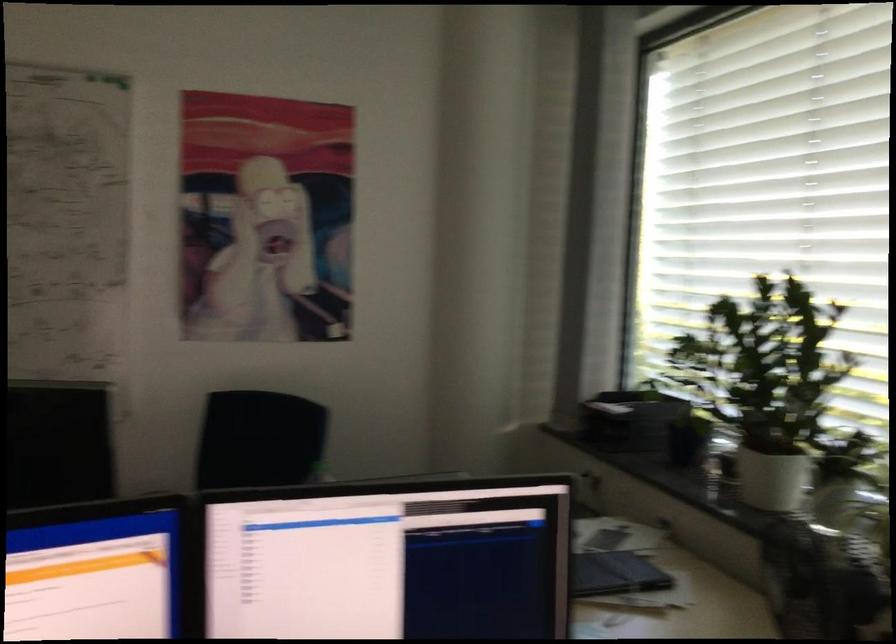
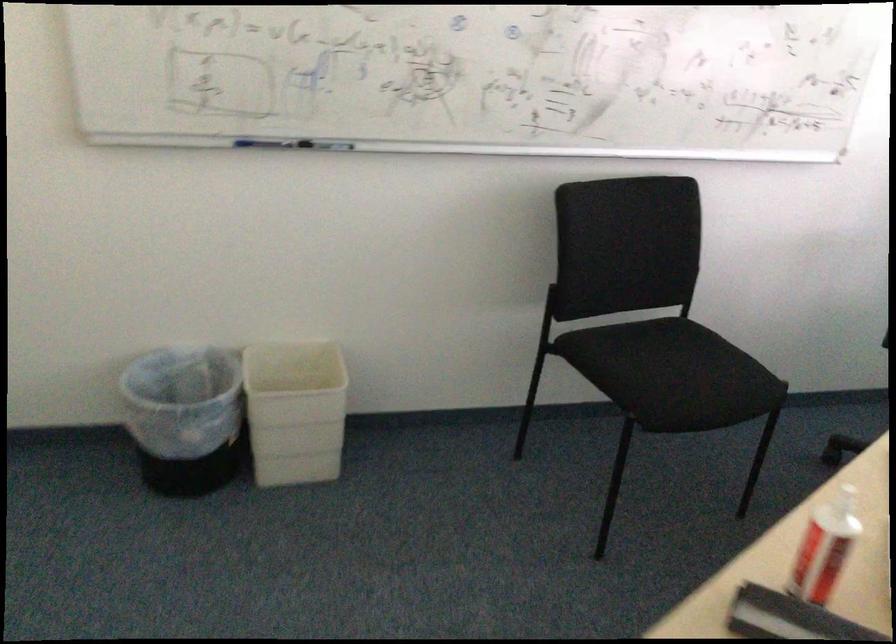
Question: Which direction would the cameraman need to move to produce the second image? Reply with the corresponding letter.

Choices:
 (A) Left
 (B) Right
 (C) Forward
 (D) Backward

Answer: (A)